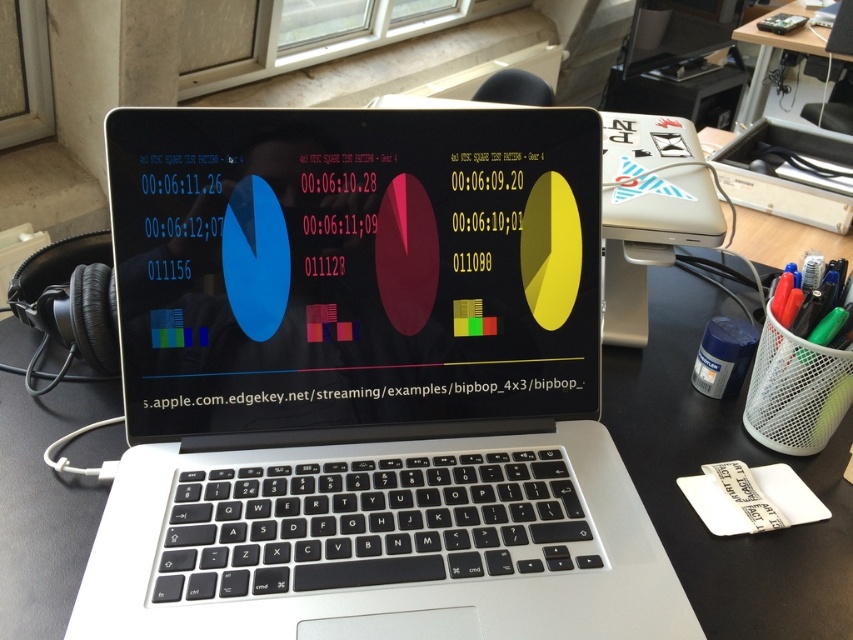
Is silver metallic laptop at center smaller than green matte pen at right?

Incorrect, silver metallic laptop at center is not smaller in size than green matte pen at right.

Based on the photo, is silver metallic laptop at center to the right of green matte pen at right from the viewer's perspective?

No, silver metallic laptop at center is not to the right of green matte pen at right.

Identify the location of silver metallic laptop at center. (364, 385).

Locate an element on the screen. Image resolution: width=853 pixels, height=640 pixels. silver metallic laptop at center is located at coordinates (364, 385).

Who is more forward, (851, 362) or (819, 38)?

Point (851, 362) is more forward.

Is green matte pen at right smaller than wooden table at upper right?

Indeed, green matte pen at right has a smaller size compared to wooden table at upper right.

Image resolution: width=853 pixels, height=640 pixels. Describe the element at coordinates (793, 385) in the screenshot. I see `green matte pen at right` at that location.

Where is `green matte pen at right`? green matte pen at right is located at coordinates (793, 385).

Is matte black screen at center wider than wooden table at upper right?

No, matte black screen at center is not wider than wooden table at upper right.

The height and width of the screenshot is (640, 853). I want to click on matte black screen at center, so click(x=352, y=269).